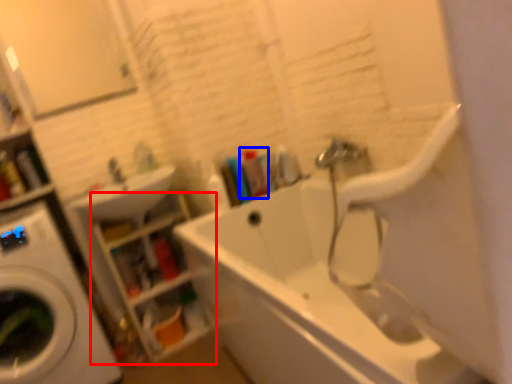
Question: Among these objects, which one is nearest to the camera, shelf (highlighted by a red box) or toiletry (highlighted by a blue box)?

Choices:
 (A) shelf
 (B) toiletry

Answer: (A)